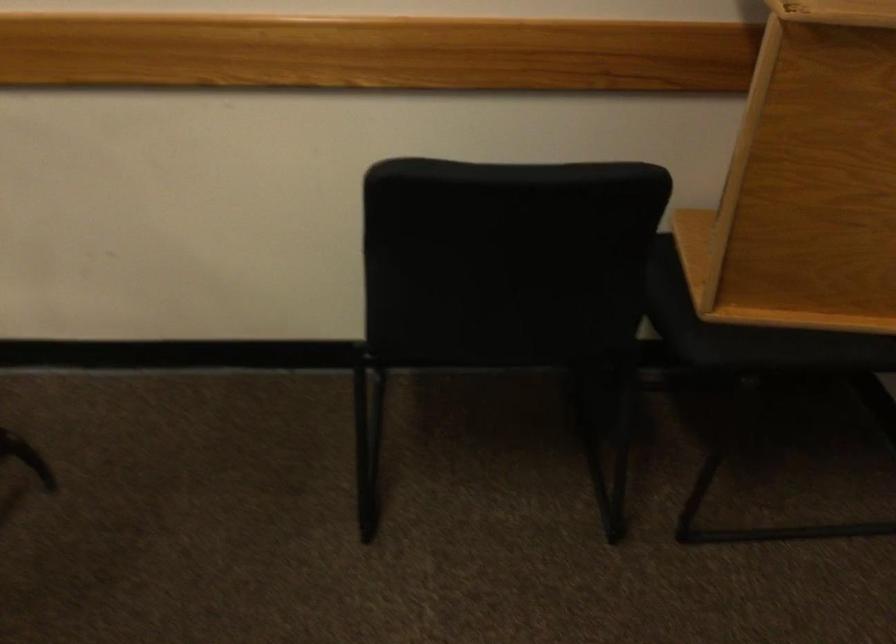
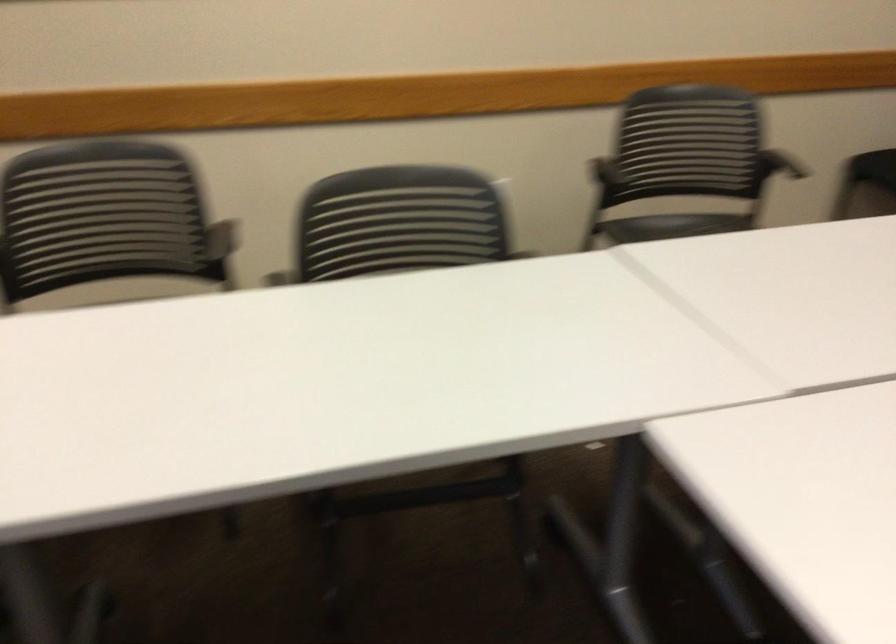
Locate, in the second image, the point that corresponds to [227,228] in the first image.

(790, 166)